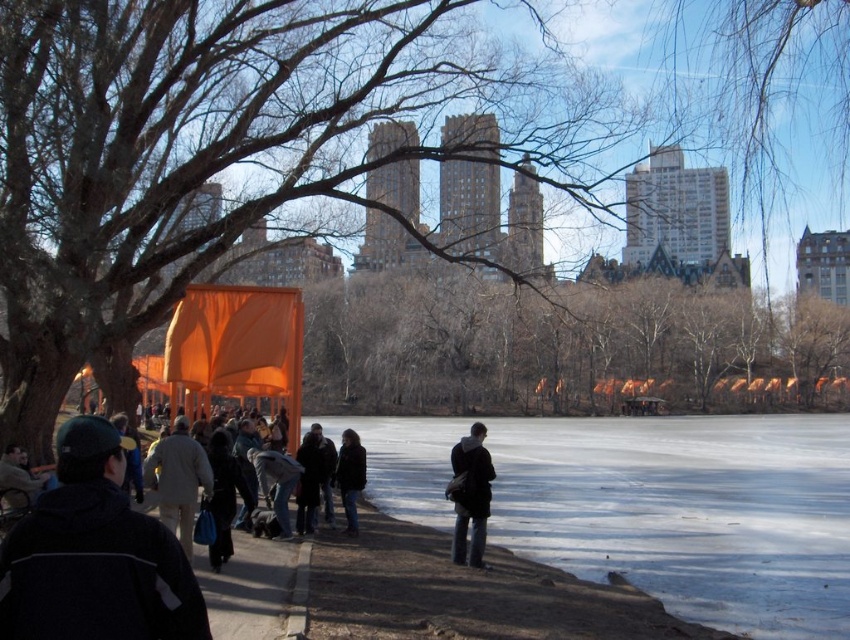
Question: Which of the following is the closest to the observer?

Choices:
 (A) orange fabric at center
 (B) light beige coat at lower left
 (C) dark brown leather jacket at center

Answer: (B)

Question: Which of the following is the farthest from the observer?

Choices:
 (A) (343, 472)
 (B) (468, 557)
 (C) (326, 467)

Answer: (A)

Question: Does smooth orange fabric at center appear on the right side of light beige coat at lower left?

Choices:
 (A) no
 (B) yes

Answer: (B)

Question: Is dark gray jacket at center positioned before dark blue jacket at lower left?

Choices:
 (A) no
 (B) yes

Answer: (B)

Question: Among these points, which one is nearest to the camera?

Choices:
 (A) (482, 548)
 (B) (0, 480)
 (C) (655, 419)

Answer: (B)

Question: Observing the image, what is the correct spatial positioning of smooth concrete pavement at lower center in reference to dark blue jacket at lower left?

Choices:
 (A) below
 (B) above

Answer: (A)